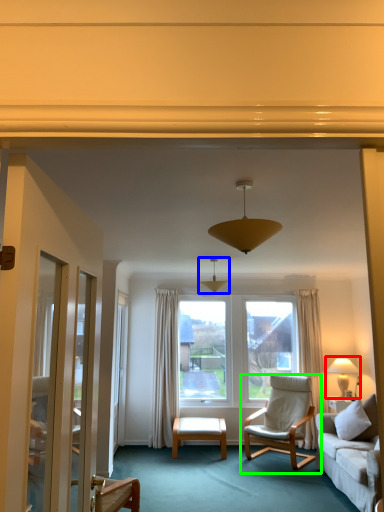
Question: Estimate the real-world distances between objects in this image. Which object is farther from lamp (highlighted by a red box), lamp (highlighted by a blue box) or chair (highlighted by a green box)?

Choices:
 (A) lamp
 (B) chair

Answer: (A)